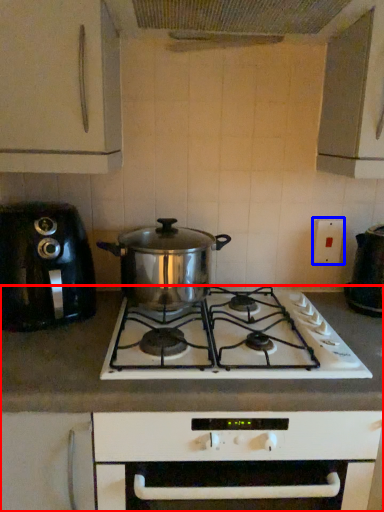
Question: Which object appears farthest to the camera in this image, countertop (highlighted by a red box) or electric outlet (highlighted by a blue box)?

Choices:
 (A) countertop
 (B) electric outlet

Answer: (B)